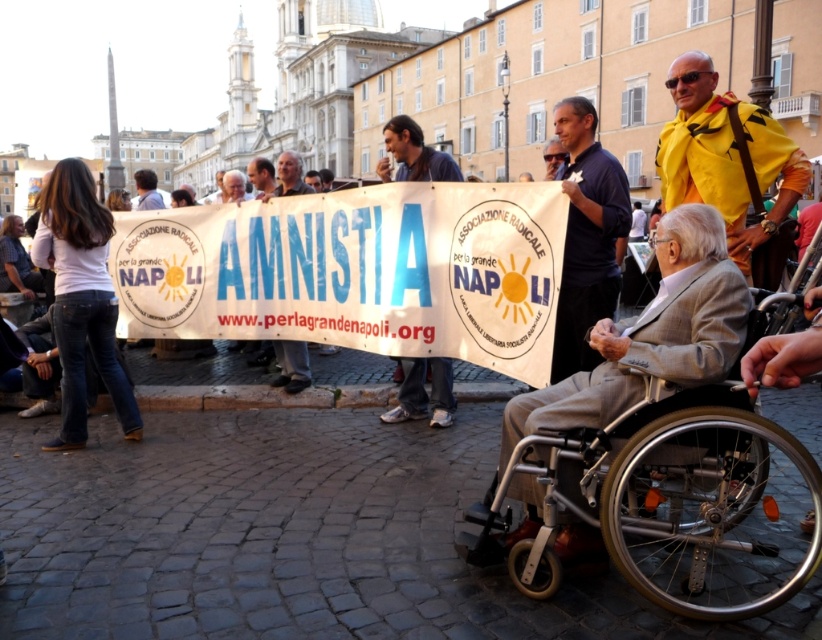
Question: Considering the real-world distances, which object is farthest from the light brown leather jacket at upper center?

Choices:
 (A) matte yellow jacket at center
 (B) silver metallic wheelchair at lower right
 (C) matte black sign at center

Answer: (A)

Question: Which of the following is the farthest from the observer?

Choices:
 (A) matte black sign at center
 (B) silver metallic wheelchair at lower right
 (C) matte yellow jacket at center
 (D) light brown leather jacket at upper center

Answer: (D)

Question: Which of the following is the closest to the observer?

Choices:
 (A) dark blue shirt at center
 (B) light brown leather jacket at upper center
 (C) silver metallic wheelchair at lower right
 (D) matte yellow jacket at center

Answer: (C)

Question: Is white paper banner at center closer to camera compared to matte black sign at center?

Choices:
 (A) yes
 (B) no

Answer: (A)

Question: Can you confirm if yellow fabric jacket at upper right is positioned below blue jeans at center?

Choices:
 (A) no
 (B) yes

Answer: (B)

Question: Does dark blue shirt at center have a smaller size compared to blue jeans at center?

Choices:
 (A) yes
 (B) no

Answer: (A)